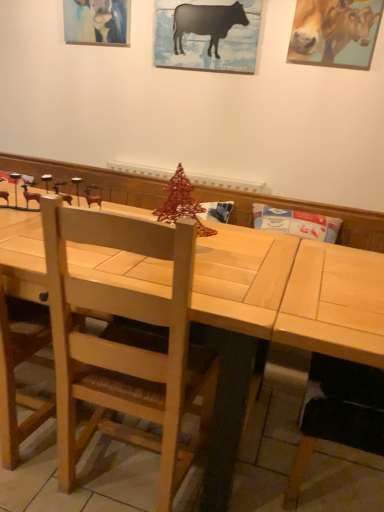
Locate an element on the screen. This screenshot has height=512, width=384. free point to the right of light brown wooden chair at center is located at coordinates (243, 465).